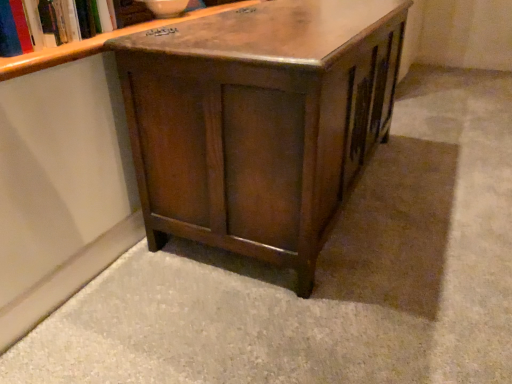
Question: Is wooden bookshelf at upper left situated inside wooden cabinet at center or outside?

Choices:
 (A) outside
 (B) inside

Answer: (A)

Question: Relative to wooden cabinet at center, is wooden bookshelf at upper left in front or behind?

Choices:
 (A) behind
 (B) front

Answer: (A)

Question: From a real-world perspective, relative to wooden cabinet at center, is wooden bookshelf at upper left vertically above or below?

Choices:
 (A) above
 (B) below

Answer: (A)

Question: From the image's perspective, is wooden cabinet at center above or below wooden bookshelf at upper left?

Choices:
 (A) below
 (B) above

Answer: (A)

Question: Is wooden cabinet at center taller or shorter than wooden bookshelf at upper left?

Choices:
 (A) tall
 (B) short

Answer: (A)

Question: Is wooden cabinet at center spatially inside wooden bookshelf at upper left, or outside of it?

Choices:
 (A) outside
 (B) inside

Answer: (A)

Question: Considering the positions of point (200, 152) and point (17, 43), is point (200, 152) closer or farther from the camera than point (17, 43)?

Choices:
 (A) farther
 (B) closer

Answer: (A)